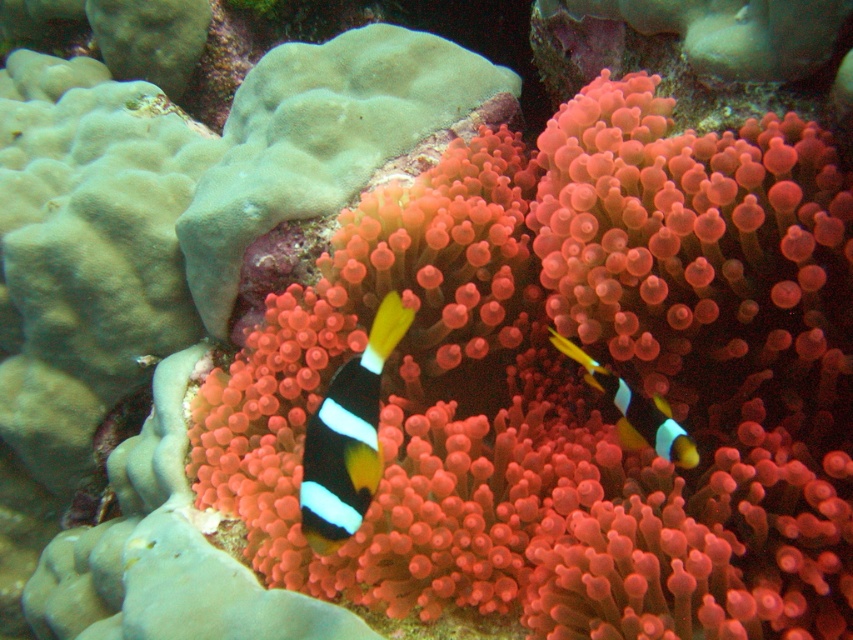
Between black and white striped clownfish at center and black and white striped fish at center, which one is positioned higher?

black and white striped fish at center

Can you confirm if black and white striped clownfish at center is positioned below black and white striped fish at center?

Yes.

Describe the element at coordinates (347, 436) in the screenshot. The image size is (853, 640). I see `black and white striped clownfish at center` at that location.

I want to click on black and white striped clownfish at center, so pos(347,436).